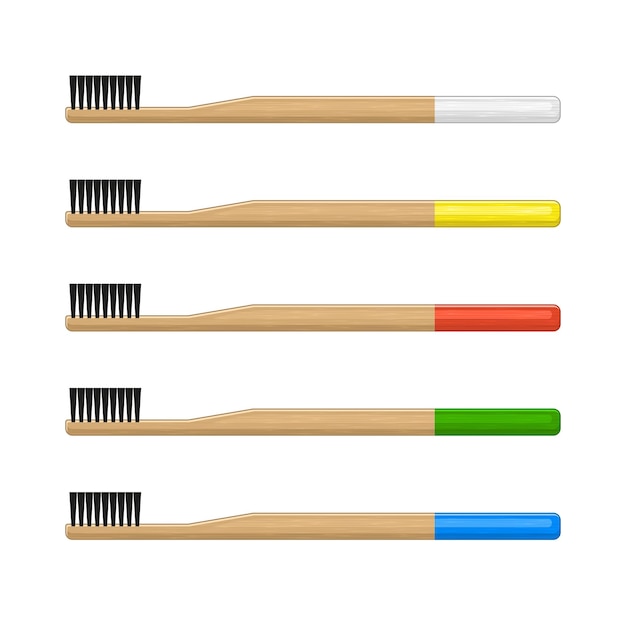
Locate an element on the screen. Image resolution: width=626 pixels, height=626 pixels. yellow paint is located at coordinates (496, 215).